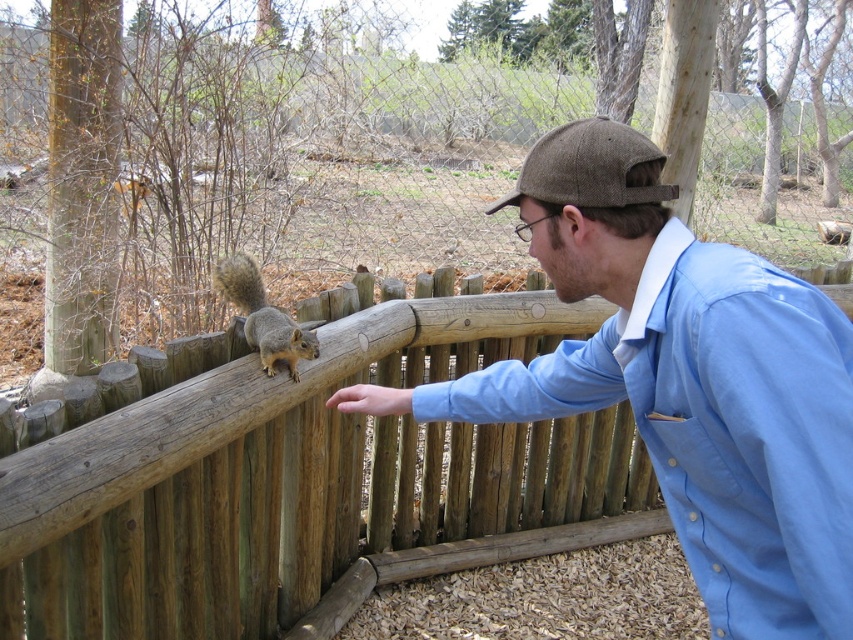
Question: Which point appears farthest from the camera in this image?

Choices:
 (A) (201, 486)
 (B) (392, 388)
 (C) (244, 332)
 (D) (749, 508)

Answer: (C)

Question: Is blue cotton shirt at center below smooth skin hand at center?

Choices:
 (A) yes
 (B) no

Answer: (B)

Question: Which object appears farthest from the camera in this image?

Choices:
 (A) brown wooden fence at center
 (B) blue cotton shirt at center

Answer: (A)

Question: Considering the relative positions of gray fur squirrel at center and smooth skin hand at center in the image provided, where is gray fur squirrel at center located with respect to smooth skin hand at center?

Choices:
 (A) below
 (B) above

Answer: (B)

Question: Does gray fur squirrel at center have a larger size compared to smooth skin hand at center?

Choices:
 (A) no
 (B) yes

Answer: (B)

Question: Which point is farther to the camera?

Choices:
 (A) gray fur squirrel at center
 (B) brown wooden fence at center
 (C) smooth skin hand at center
 (D) blue cotton shirt at center

Answer: (A)